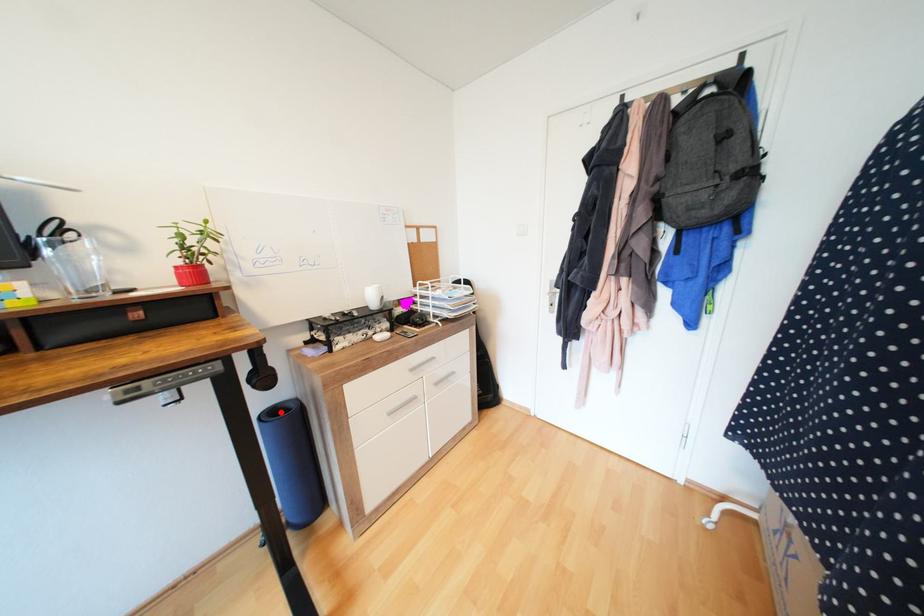
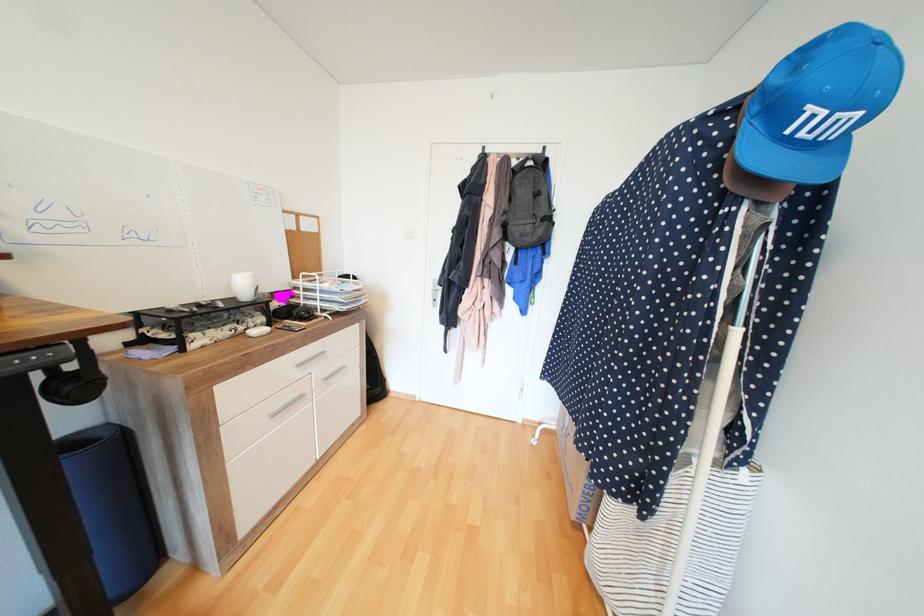
Find the pixel in the second image that matches the highlighted location in the first image.

(80, 443)